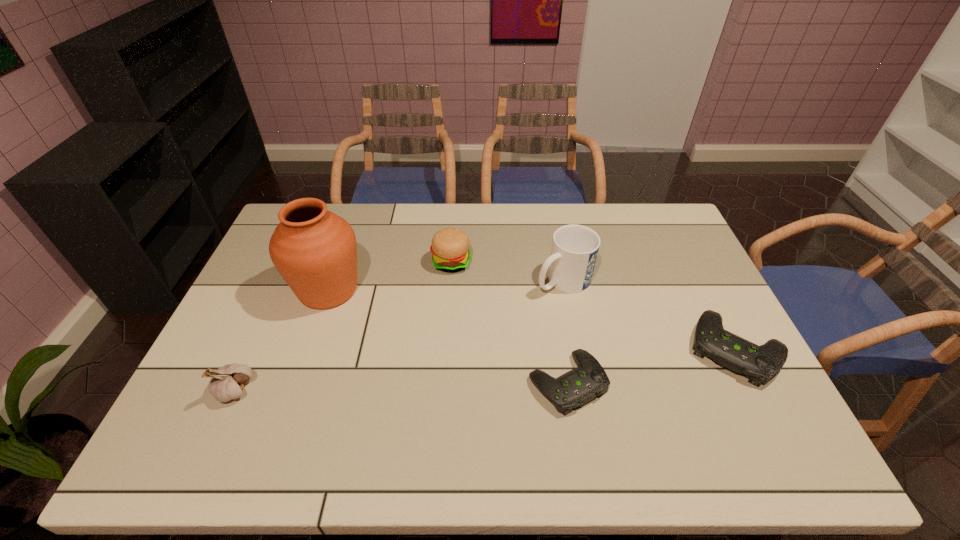
This screenshot has height=540, width=960. Find the location of `vacant region between the urn and the right control`. vacant region between the urn and the right control is located at coordinates (532, 319).

Identify the location of vacant area that lies between the fifth shortest object and the shorter control. The height and width of the screenshot is (540, 960). (565, 332).

In order to click on free area in between the shorter control and the garlic in this screenshot , I will do `click(401, 386)`.

This screenshot has height=540, width=960. Find the location of `object that is the third closest to the fifth shortest object`. object that is the third closest to the fifth shortest object is located at coordinates (758, 363).

At what (x,y) coordinates should I click in order to perform the action: click on object that is the third nearest to the right control. Please return your answer as a coordinate pair (x, y). Looking at the image, I should click on (450, 246).

Locate an element on the screen. The width and height of the screenshot is (960, 540). vacant point that satisfies the following two spatial constraints: 1. on the front side of the second shortest object; 2. on the left side of the tallest object is located at coordinates (308, 349).

Where is `vacant space that satisfies the following two spatial constraints: 1. on the back side of the garlic; 2. on the left side of the mug`? vacant space that satisfies the following two spatial constraints: 1. on the back side of the garlic; 2. on the left side of the mug is located at coordinates (284, 281).

Locate an element on the screen. vacant region that satisfies the following two spatial constraints: 1. on the back side of the third object from left to right; 2. on the left side of the garlic is located at coordinates (293, 262).